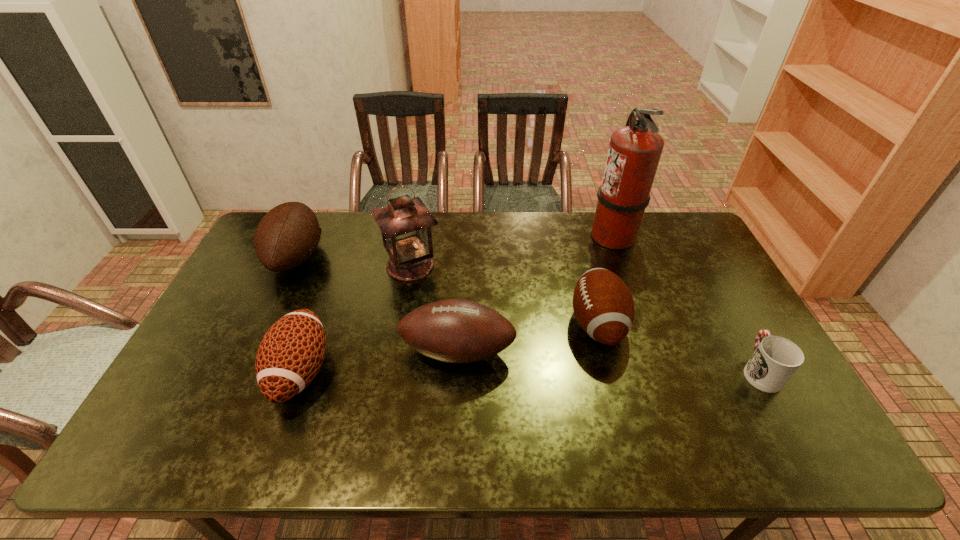
This screenshot has width=960, height=540. What are the coordinates of `free space located 0.160m on the front of the second football from right to left` in the screenshot? It's located at (454, 435).

Image resolution: width=960 pixels, height=540 pixels. I want to click on blank space located on the laces of the rightmost football, so click(451, 324).

Find the location of `free space located on the laces of the rightmost football`. free space located on the laces of the rightmost football is located at coordinates (431, 324).

Locate an element on the screen. vacant region located on the laces of the rightmost football is located at coordinates (539, 324).

Locate an element on the screen. The width and height of the screenshot is (960, 540). free space located on the handle side of the rightmost object is located at coordinates (722, 302).

At what (x,y) coordinates should I click in order to perform the action: click on free space located 0.310m on the handle side of the rightmost object. Please return your answer as a coordinate pair (x, y). This screenshot has height=540, width=960. Looking at the image, I should click on (706, 273).

Where is `free point located 0.100m on the handle side of the rightmost object`? free point located 0.100m on the handle side of the rightmost object is located at coordinates (733, 322).

The height and width of the screenshot is (540, 960). What are the coordinates of `fire extinguisher situated at the far edge` in the screenshot? It's located at (634, 152).

At what (x,y) coordinates should I click in order to perform the action: click on oil lamp that is positioned at the far edge. Please return your answer as a coordinate pair (x, y). This screenshot has height=540, width=960. Looking at the image, I should click on coord(405,224).

Find the location of a particular element. This screenshot has height=540, width=960. football that is at the far edge is located at coordinates (287, 235).